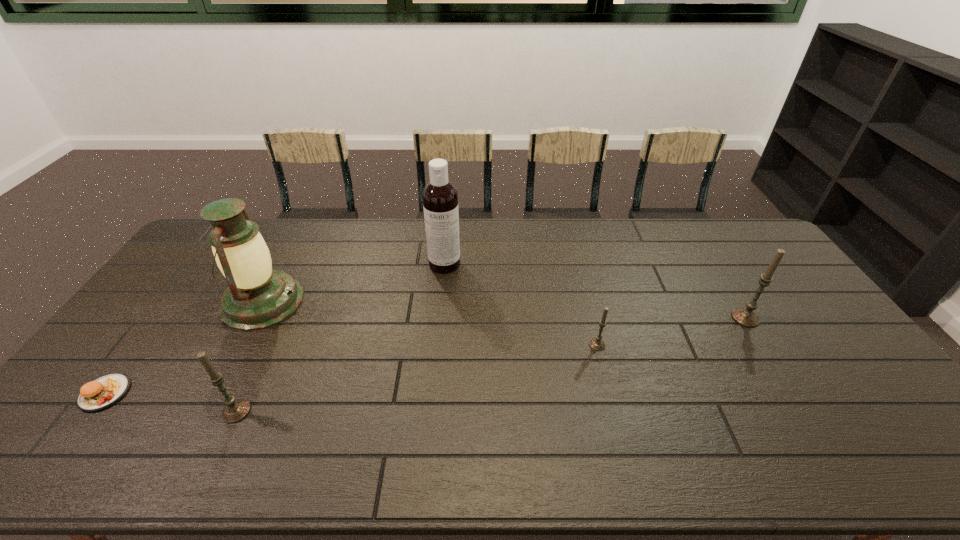
Image resolution: width=960 pixels, height=540 pixels. I want to click on candle that is the third closest to the lantern, so click(x=747, y=317).

Identify the location of vacant space that satisfies the following two spatial constraints: 1. on the back side of the fifth tallest object; 2. with the light compartment facing forward on the lantern. Image resolution: width=960 pixels, height=540 pixels. (586, 302).

Identify the location of vacant region that satisfies the following two spatial constraints: 1. on the back side of the second candle from left to right; 2. on the right side of the farthest candle. (590, 318).

At what (x,y) coordinates should I click in order to perform the action: click on free spot that satisfies the following two spatial constraints: 1. on the back side of the leftmost candle; 2. on the left side of the second candle from left to right. Please return your answer as a coordinate pair (x, y). The image size is (960, 540). Looking at the image, I should click on (268, 345).